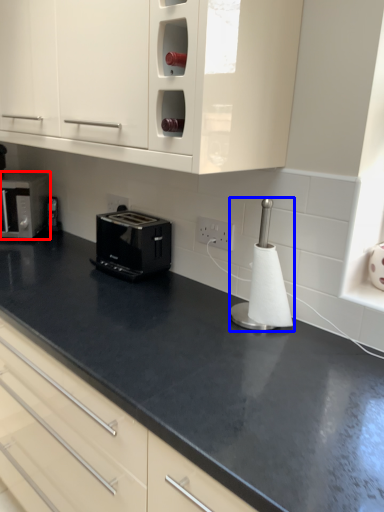
Question: Which point is further to the camera, home appliance (highlighted by a red box) or appliance (highlighted by a blue box)?

Choices:
 (A) home appliance
 (B) appliance

Answer: (A)